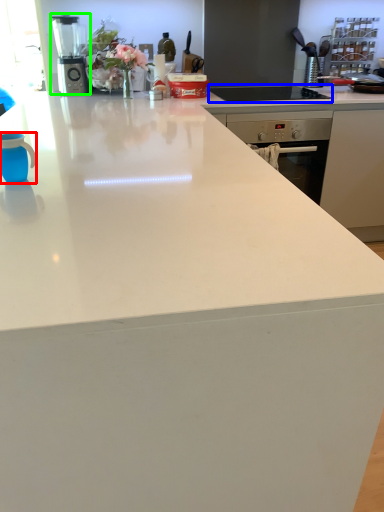
Question: Estimate the real-world distances between objects in this image. Which object is farther from mug (highlighted by a red box), gas stove (highlighted by a blue box) or kitchen appliance (highlighted by a green box)?

Choices:
 (A) gas stove
 (B) kitchen appliance

Answer: (B)